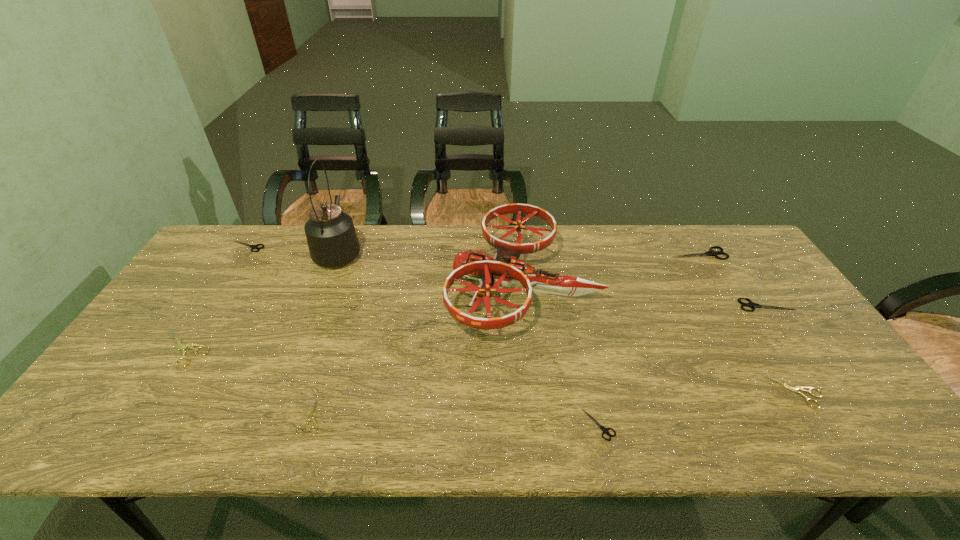
Locate which object ranks fourth in proximity to the fourth nearest shears. Please provide its 2D coordinates. Your answer should be formatted as a tuple, i.e. [(x, y)], where the tuple contains the x and y coordinates of a point satisfying the conditions above.

[(505, 268)]

Find the location of a particular element. object that is the eighth closest to the third smallest black shears is located at coordinates pyautogui.click(x=251, y=246).

You are a GUI agent. You are given a task and a screenshot of the screen. Output one action in this format:
    pyautogui.click(x=<x>, y=<y>)
    Task: Click on the shears that is the sixth closest to the tallest shears
    This screenshot has width=960, height=540.
    Given the screenshot: What is the action you would take?
    pyautogui.click(x=182, y=347)

Locate which shears ranks fifth in proximity to the smallest black shears. Please provide its 2D coordinates. Your answer should be formatted as a tuple, i.e. [(x, y)], where the tuple contains the x and y coordinates of a point satisfying the conditions above.

[(182, 347)]

Locate an element on the screen. black shears that is the second closest to the sixth shortest object is located at coordinates (605, 430).

Locate an element on the screen. This screenshot has width=960, height=540. the second closest black shears to the tallest shears is located at coordinates (605, 430).

Locate an element on the screen. This screenshot has height=540, width=960. beige shears that is the second nearest to the second biggest beige shears is located at coordinates (182, 347).

Choose which beige shears is the second nearest neighbor to the fifth shears from right to left. Please provide its 2D coordinates. Your answer should be formatted as a tuple, i.e. [(x, y)], where the tuple contains the x and y coordinates of a point satisfying the conditions above.

[(795, 389)]